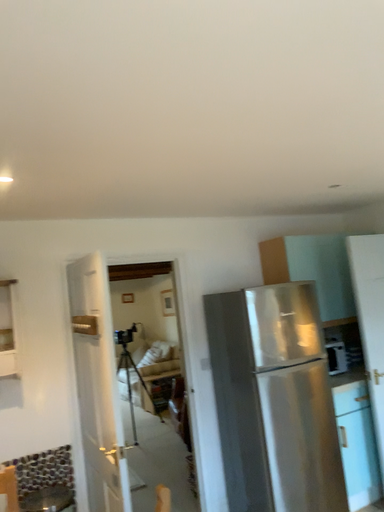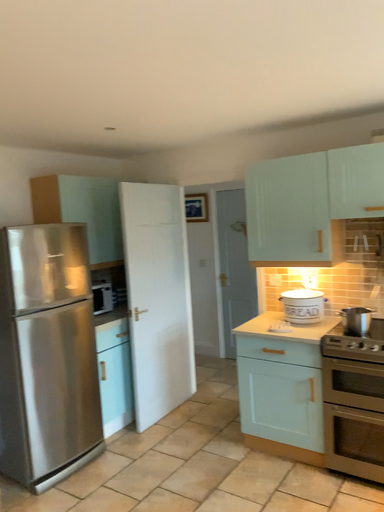
Question: Which way did the camera rotate in the video?

Choices:
 (A) rotated upward
 (B) rotated downward

Answer: (B)